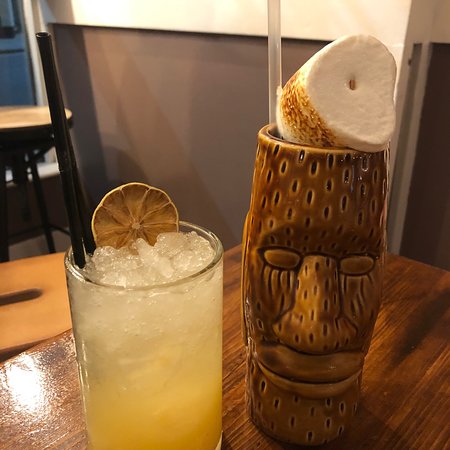
Identify the location of clear glass. The image size is (450, 450). (125, 354), (194, 227), (74, 272).